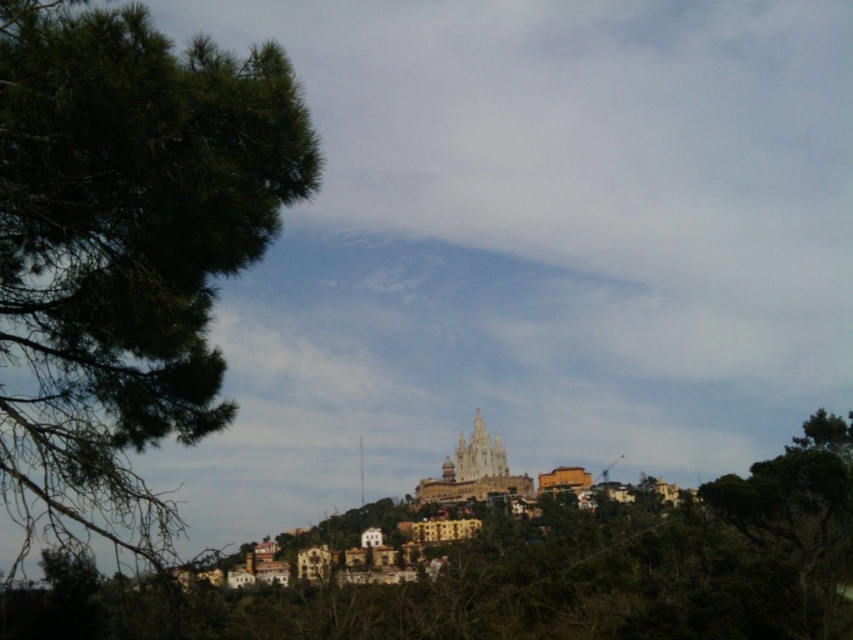
Question: Is green leafy tree at left above light brown stone tower at center?

Choices:
 (A) no
 (B) yes

Answer: (B)

Question: Which point is farther from the camera taking this photo?

Choices:
 (A) (450, 488)
 (B) (3, 96)
 (C) (488, 436)

Answer: (C)

Question: Does green leafy tree at left appear on the right side of light brown stone tower at center?

Choices:
 (A) no
 (B) yes

Answer: (A)

Question: Which point appears farthest from the camera in this image?

Choices:
 (A) (x=281, y=58)
 (B) (x=416, y=497)
 (C) (x=500, y=468)

Answer: (C)

Question: Considering the real-world distances, which object is farthest from the golden stone tower at center?

Choices:
 (A) light brown stone tower at center
 (B) green leafy tree at left

Answer: (B)

Question: Observing the image, what is the correct spatial positioning of green leafy tree at left in reference to light brown stone tower at center?

Choices:
 (A) left
 (B) right

Answer: (A)